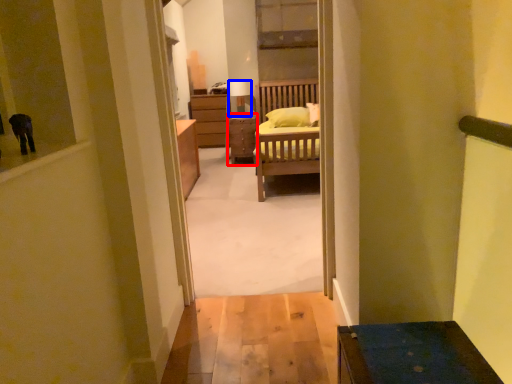
Question: Which point is further to the camera, table (highlighted by a red box) or lamp (highlighted by a blue box)?

Choices:
 (A) table
 (B) lamp

Answer: (B)